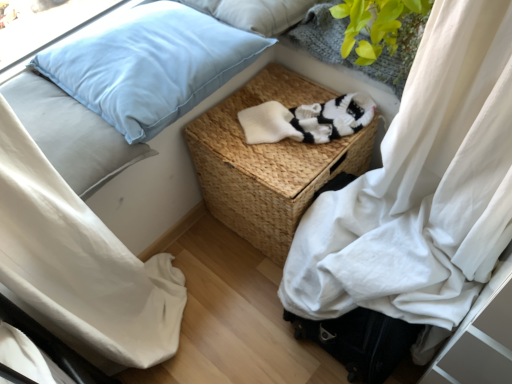
You are a GUI agent. You are given a task and a screenshot of the screen. Output one action in this format:
    pyautogui.click(x=<x>, y=<y>)
    Task: Click on the blank space situated above light blue fabric pillow at upper left, which is the second pillow from bottom to top (from a real-world perspective)
    
    Given the screenshot: What is the action you would take?
    pyautogui.click(x=136, y=36)